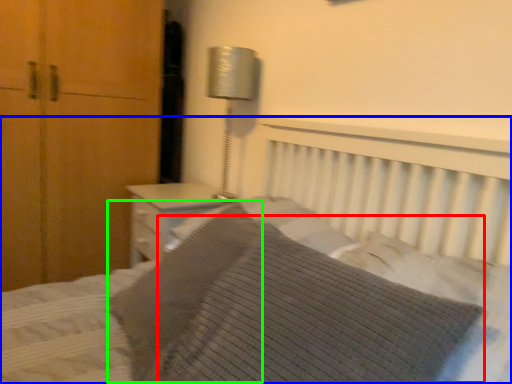
Question: Based on their relative distances, which object is farther from pillow (highlighted by a red box)? Choose from bed (highlighted by a blue box) and pillow (highlighted by a green box).

Choices:
 (A) bed
 (B) pillow

Answer: (B)